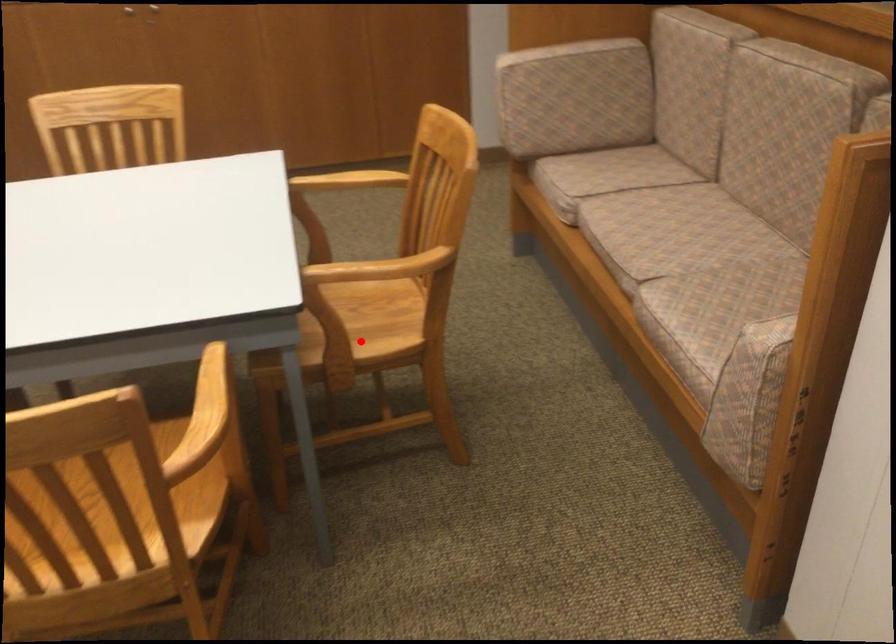
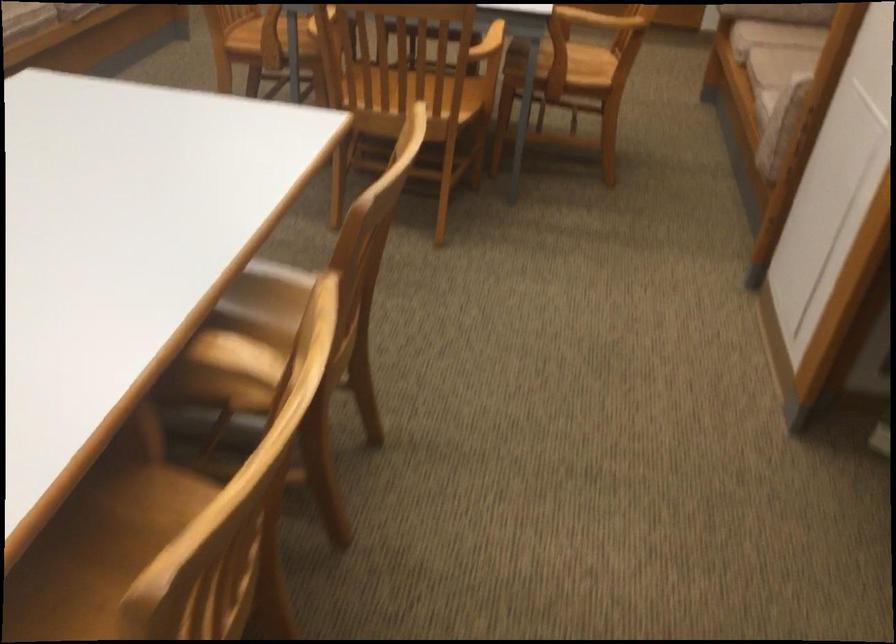
Question: I am providing you with two images of the same scene from different viewpoints. A red point is shown in image1. For the corresponding object point in image2, is it positioned nearer or farther from the camera?

Choices:
 (A) Nearer
 (B) Farther

Answer: (B)